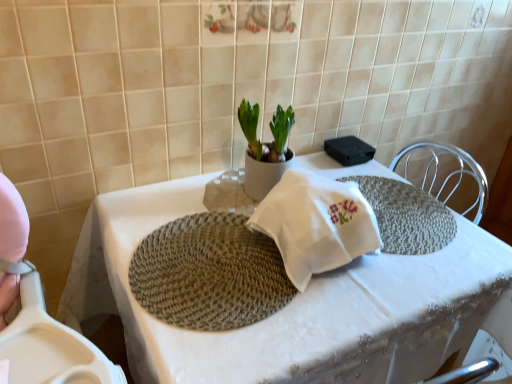
Question: From a real-world perspective, does rattan placemat at center sit lower than white ceramic pot at center?

Choices:
 (A) yes
 (B) no

Answer: (A)

Question: Is rattan placemat at center turned away from white ceramic pot at center?

Choices:
 (A) no
 (B) yes

Answer: (A)

Question: Can you confirm if rattan placemat at center is smaller than white ceramic pot at center?

Choices:
 (A) no
 (B) yes

Answer: (B)

Question: Does rattan placemat at center touch white ceramic pot at center?

Choices:
 (A) yes
 (B) no

Answer: (B)

Question: Does rattan placemat at center appear on the left side of white ceramic pot at center?

Choices:
 (A) no
 (B) yes

Answer: (B)

Question: Relative to white ceramic pot at center, is rattan placemat at center in front or behind?

Choices:
 (A) behind
 (B) front

Answer: (B)

Question: Is rattan placemat at center taller or shorter than white ceramic pot at center?

Choices:
 (A) short
 (B) tall

Answer: (A)

Question: In the image, is rattan placemat at center on the left side or the right side of white ceramic pot at center?

Choices:
 (A) right
 (B) left

Answer: (B)

Question: Is rattan placemat at center bigger or smaller than white ceramic pot at center?

Choices:
 (A) big
 (B) small

Answer: (B)

Question: Is rattan placemat at center taller or shorter than white woven placemat at center?

Choices:
 (A) tall
 (B) short

Answer: (B)

Question: From the image's perspective, relative to white woven placemat at center, is rattan placemat at center above or below?

Choices:
 (A) below
 (B) above

Answer: (B)

Question: Is point (166, 233) positioned closer to the camera than point (352, 273)?

Choices:
 (A) closer
 (B) farther

Answer: (B)

Question: Would you say rattan placemat at center is to the left or to the right of white woven placemat at center in the picture?

Choices:
 (A) left
 (B) right

Answer: (A)

Question: In the image, is white ceramic pot at center on the left side or the right side of rattan placemat at center?

Choices:
 (A) left
 (B) right

Answer: (B)

Question: From a real-world perspective, is white ceramic pot at center positioned above or below rattan placemat at center?

Choices:
 (A) below
 (B) above

Answer: (B)